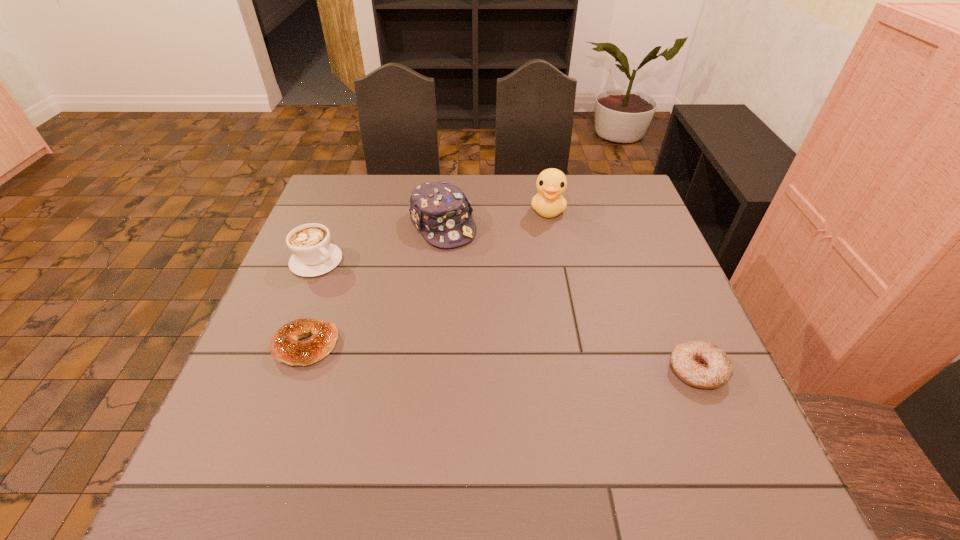
Where is `vacant space located 0.370m to the right of the cappuccino's handle`? The width and height of the screenshot is (960, 540). vacant space located 0.370m to the right of the cappuccino's handle is located at coordinates click(441, 340).

At what (x,y) coordinates should I click in order to perform the action: click on vacant point located to the right of the cappuccino's handle. Please return your answer as a coordinate pair (x, y). The width and height of the screenshot is (960, 540). Looking at the image, I should click on click(x=399, y=313).

The image size is (960, 540). Identify the location of vacant position located on the front-facing side of the second tallest object. (519, 339).

Locate an element on the screen. free space located on the front-facing side of the second tallest object is located at coordinates (484, 288).

Identify the location of free space located on the front-facing side of the second tallest object. The image size is (960, 540). (500, 312).

At what (x,y) coordinates should I click in order to perform the action: click on vacant space located on the face of the duck. Please return your answer as a coordinate pair (x, y). This screenshot has width=960, height=540. Looking at the image, I should click on (540, 316).

Identify the location of vacant region located on the face of the duck. This screenshot has width=960, height=540. (541, 292).

Locate an element on the screen. The image size is (960, 540). free space located 0.260m on the face of the duck is located at coordinates (542, 287).

What are the coordinates of `headwear that is at the far edge` in the screenshot? It's located at (440, 210).

Identify the location of duck that is positioned at the far edge. (551, 183).